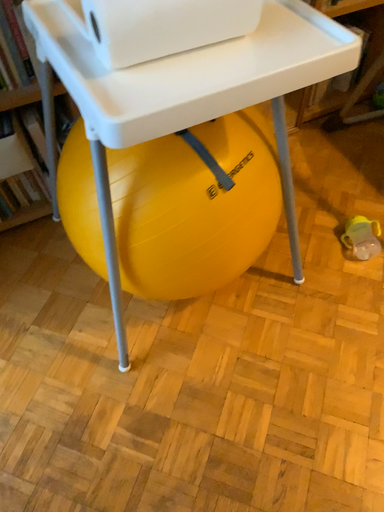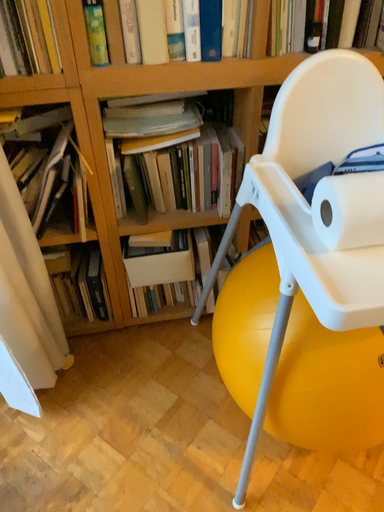
Question: Which way did the camera rotate in the video?

Choices:
 (A) rotated right
 (B) rotated left

Answer: (B)